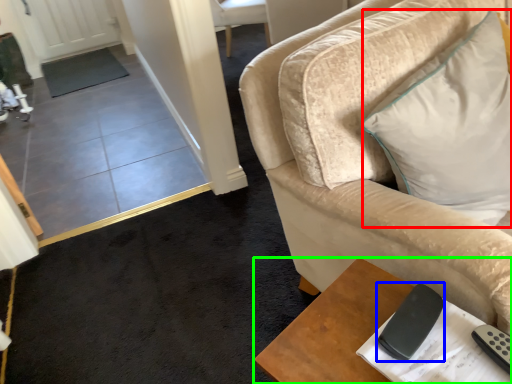
Question: Considering the real-world distances, which object is closest to pillow (highlighted by a red box)? remote (highlighted by a blue box) or table (highlighted by a green box).

Choices:
 (A) remote
 (B) table

Answer: (A)